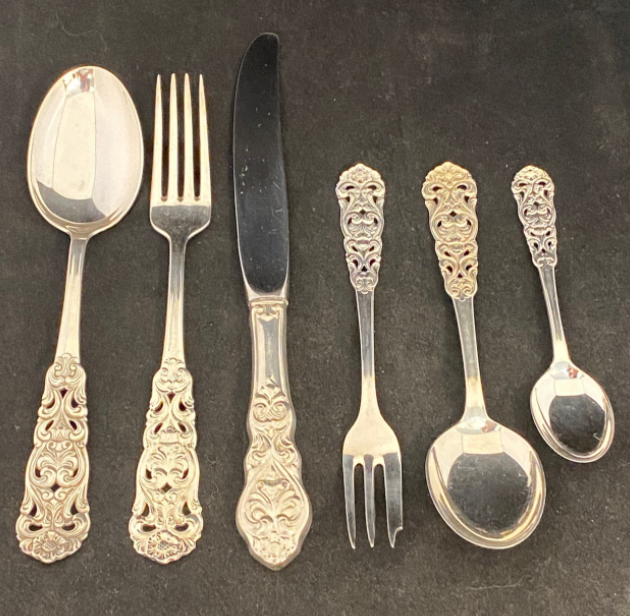
What are the coordinates of `silverware` in the screenshot? It's located at (69, 360), (163, 383), (275, 365), (358, 349), (450, 344), (561, 325).